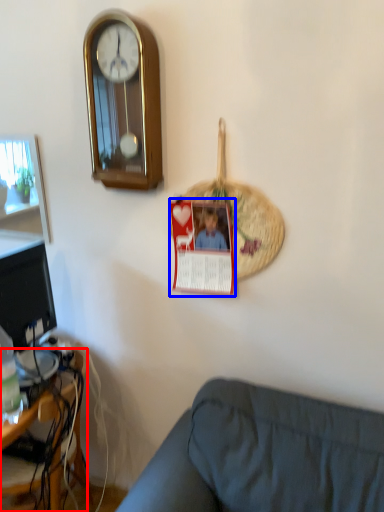
Question: Which object appears closest to the camera in this image, desk (highlighted by a red box) or postcard (highlighted by a blue box)?

Choices:
 (A) desk
 (B) postcard

Answer: (B)